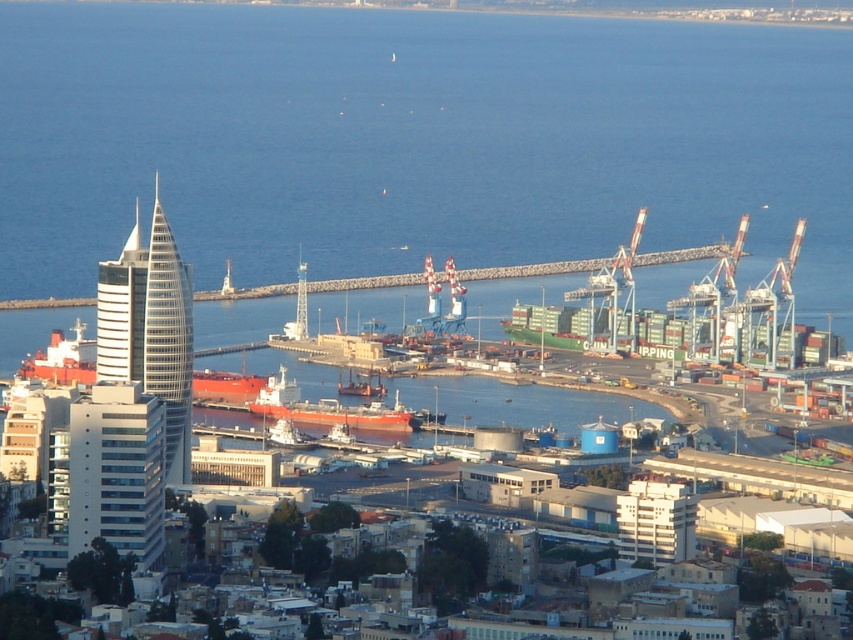
You are a crane operator at the port and need to move a container from the matte orange ship at center to the blue water at center. The crane can reach up to 50 meters. Can you safely move the container using the crane?

The distance between the matte orange ship at center and the blue water at center is 52.50 meters, which exceeds the crane operator can reach up to 50 meters. Therefore, the crane cannot safely move the container to the blue water at center.

You are standing at the point marked by the coordinates point (415, 141) in the port scene. What do you see directly below you?

The point (415, 141) marks blue water at center, so you are directly above the blue water at center.